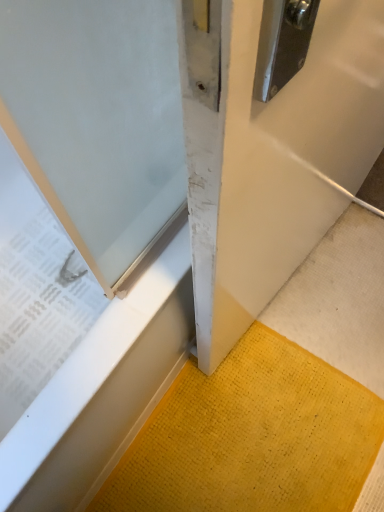
Question: Is yellow textured mat at lower right far from white matte door at center?

Choices:
 (A) no
 (B) yes

Answer: (A)

Question: Is yellow textured mat at lower right placed right next to white matte door at center?

Choices:
 (A) no
 (B) yes

Answer: (A)

Question: Can you confirm if yellow textured mat at lower right is thinner than white matte door at center?

Choices:
 (A) no
 (B) yes

Answer: (A)

Question: From the image's perspective, is yellow textured mat at lower right under white matte door at center?

Choices:
 (A) no
 (B) yes

Answer: (B)

Question: Considering the relative positions of yellow textured mat at lower right and white matte door at center in the image provided, is yellow textured mat at lower right in front of white matte door at center?

Choices:
 (A) no
 (B) yes

Answer: (A)

Question: Can you confirm if yellow textured mat at lower right is taller than white matte door at center?

Choices:
 (A) no
 (B) yes

Answer: (A)

Question: Is the position of white matte door at center less distant than that of yellow textured mat at lower right?

Choices:
 (A) no
 (B) yes

Answer: (B)

Question: Is white matte door at center surrounding yellow textured mat at lower right?

Choices:
 (A) yes
 (B) no

Answer: (B)

Question: Is white matte door at center positioned far away from yellow textured mat at lower right?

Choices:
 (A) yes
 (B) no

Answer: (B)

Question: Can you confirm if white matte door at center is shorter than yellow textured mat at lower right?

Choices:
 (A) no
 (B) yes

Answer: (A)

Question: Can you confirm if white matte door at center is taller than yellow textured mat at lower right?

Choices:
 (A) yes
 (B) no

Answer: (A)

Question: Is white matte door at center positioned with its back to yellow textured mat at lower right?

Choices:
 (A) no
 (B) yes

Answer: (A)

Question: Is white matte door at center in front of or behind yellow textured mat at lower right in the image?

Choices:
 (A) behind
 (B) front

Answer: (B)